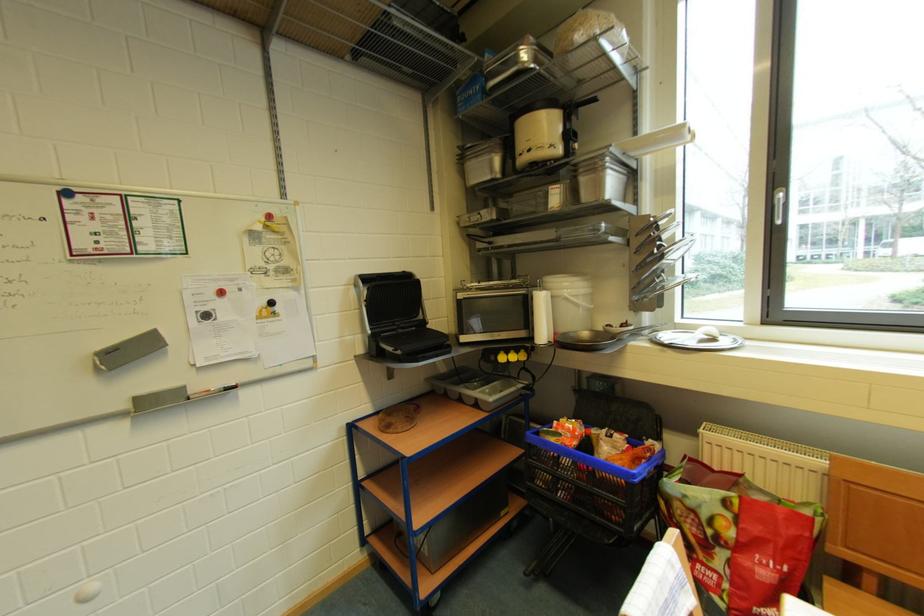
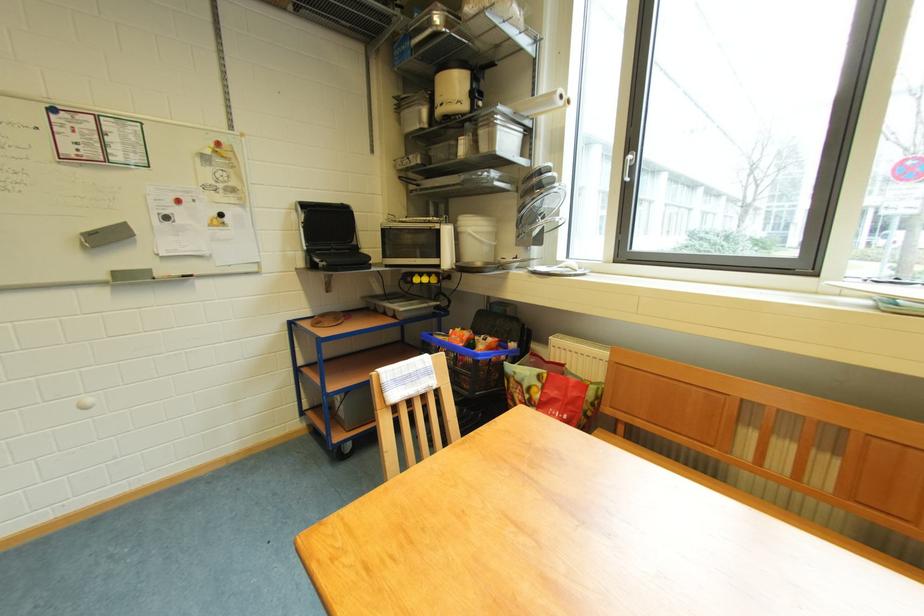
The point at (362, 288) is marked in the first image. Where is the corresponding point in the second image?

(305, 214)